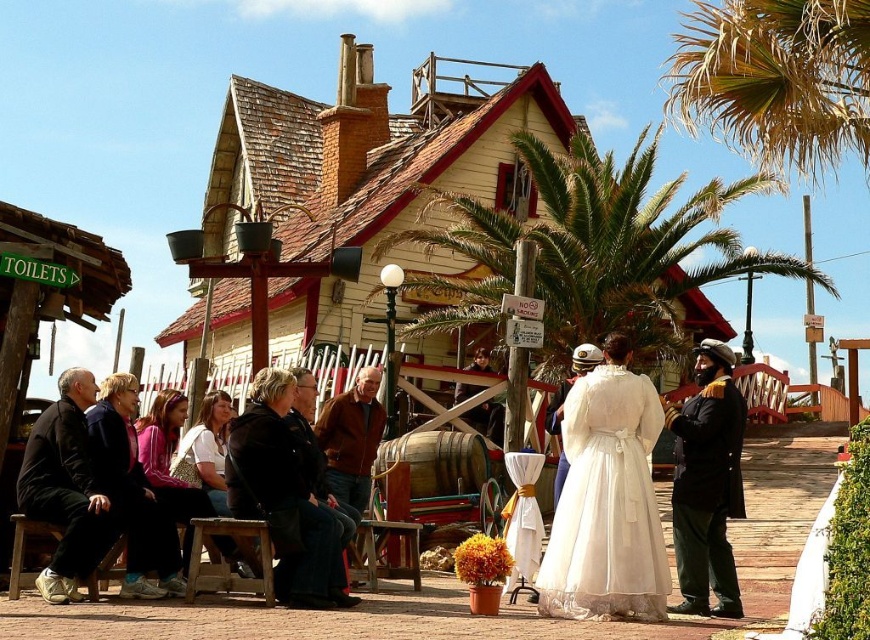
Is point (696, 122) positioned before point (126, 529)?

No, (696, 122) is behind (126, 529).

Is the position of brown leafy palm tree at upper right less distant than that of dark blue jeans at center?

That is False.

The width and height of the screenshot is (870, 640). Describe the element at coordinates (775, 81) in the screenshot. I see `brown leafy palm tree at upper right` at that location.

Locate an element on the screen. This screenshot has width=870, height=640. brown leafy palm tree at upper right is located at coordinates (775, 81).

Which is more to the left, black leather jacket at center or brown leather jacket at center?

black leather jacket at center

Is black leather jacket at center positioned at the back of brown leather jacket at center?

No.

Is point (290, 374) closer to camera compared to point (360, 499)?

Yes.

Locate an element on the screen. black leather jacket at center is located at coordinates (284, 497).

Who is positioned more to the right, black fabric jacket at left or brown leather jacket at center?

brown leather jacket at center

Identify the location of black fabric jacket at left. (65, 488).

Between point (75, 468) and point (373, 422), which one is positioned behind?

The point (373, 422) is more distant.

You are a GUI agent. You are given a task and a screenshot of the screen. Output one action in this format:
    pyautogui.click(x=<x>, y=<y>)
    Task: Click on the black fabric jacket at left
    This screenshot has width=870, height=640.
    Given the screenshot: What is the action you would take?
    pyautogui.click(x=65, y=488)